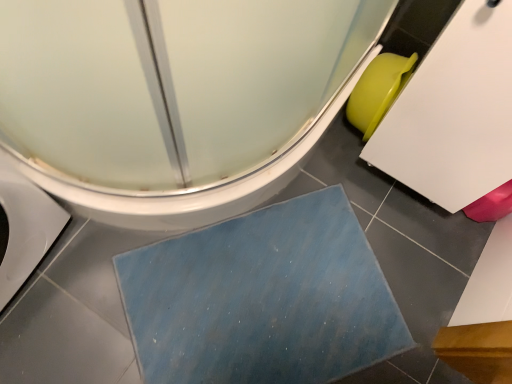
Question: Can you confirm if blue textured bath mat at lower center is shorter than green matte toilet bowl at right?

Choices:
 (A) yes
 (B) no

Answer: (A)

Question: Does blue textured bath mat at lower center appear on the right side of green matte toilet bowl at right?

Choices:
 (A) no
 (B) yes

Answer: (A)

Question: Is blue textured bath mat at lower center behind green matte toilet bowl at right?

Choices:
 (A) no
 (B) yes

Answer: (A)

Question: Is there a large distance between blue textured bath mat at lower center and green matte toilet bowl at right?

Choices:
 (A) yes
 (B) no

Answer: (B)

Question: Could you tell me if blue textured bath mat at lower center is turned towards green matte toilet bowl at right?

Choices:
 (A) yes
 (B) no

Answer: (B)

Question: Does point (203, 76) appear closer or farther from the camera than point (379, 59)?

Choices:
 (A) closer
 (B) farther

Answer: (A)

Question: Relative to green matte toilet bowl at right, is white glossy toilet at lower left in front or behind?

Choices:
 (A) front
 (B) behind

Answer: (A)

Question: From the image's perspective, is white glossy toilet at lower left above or below green matte toilet bowl at right?

Choices:
 (A) below
 (B) above

Answer: (B)

Question: Is white glossy toilet at lower left situated inside green matte toilet bowl at right or outside?

Choices:
 (A) inside
 (B) outside

Answer: (B)

Question: From the image's perspective, is white glossy toilet at lower left positioned above or below blue textured bath mat at lower center?

Choices:
 (A) below
 (B) above

Answer: (B)

Question: Is point (265, 172) closer or farther from the camera than point (217, 306)?

Choices:
 (A) closer
 (B) farther

Answer: (A)

Question: In terms of size, does white glossy toilet at lower left appear bigger or smaller than blue textured bath mat at lower center?

Choices:
 (A) big
 (B) small

Answer: (A)

Question: Considering their positions, is white glossy toilet at lower left located in front of or behind blue textured bath mat at lower center?

Choices:
 (A) behind
 (B) front

Answer: (B)

Question: Considering the positions of blue textured bath mat at lower center and white glossy toilet at lower left in the image, is blue textured bath mat at lower center wider or thinner than white glossy toilet at lower left?

Choices:
 (A) wide
 (B) thin

Answer: (B)

Question: Choose the correct answer: Is blue textured bath mat at lower center inside white glossy toilet at lower left or outside it?

Choices:
 (A) outside
 (B) inside

Answer: (A)